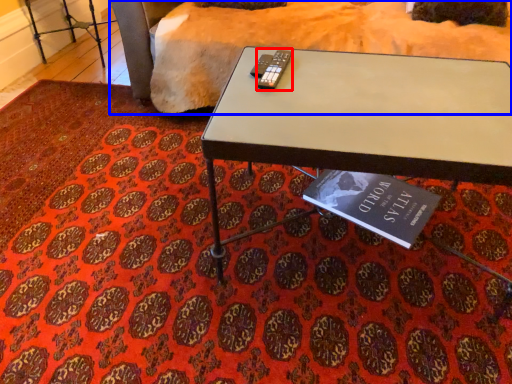
Question: Which object appears closest to the camera in this image, remote (highlighted by a red box) or bedding (highlighted by a blue box)?

Choices:
 (A) remote
 (B) bedding

Answer: (A)